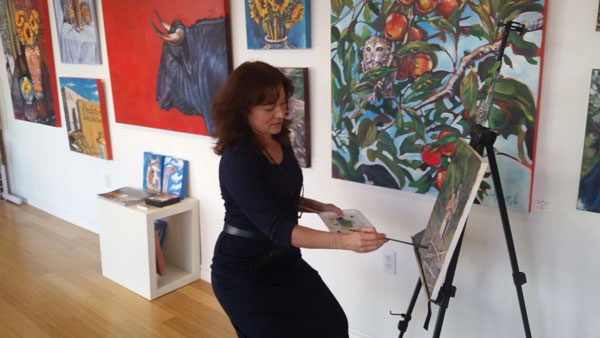
Where is `easel`? This screenshot has height=338, width=600. easel is located at coordinates (441, 311).